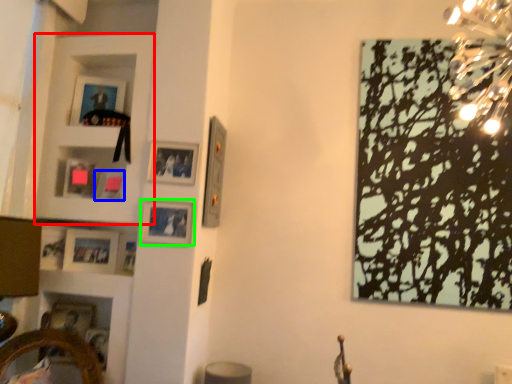
Question: Considering the real-world distances, which object is farthest from cabinet (highlighted by a red box)? picture frame (highlighted by a blue box) or picture frame (highlighted by a green box)?

Choices:
 (A) picture frame
 (B) picture frame

Answer: (B)